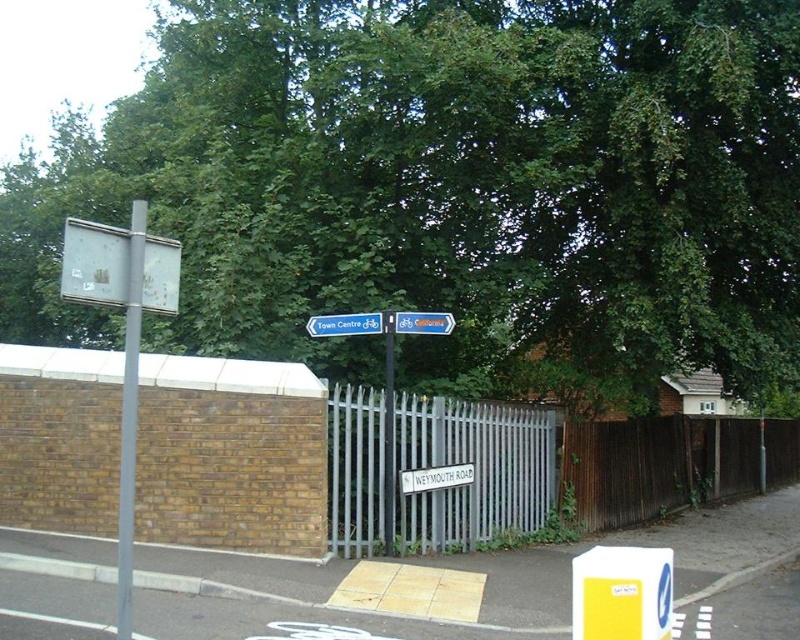
Question: Does silver metallic fence at center lie in front of gray metallic pole at left?

Choices:
 (A) no
 (B) yes

Answer: (A)

Question: Which is farther from the white plastic sign at upper left?

Choices:
 (A) yellow plastic bus stop at center
 (B) gray metallic pole at left
 (C) white plastic sign at center

Answer: (C)

Question: Which point is closer to the camera?

Choices:
 (A) (66, 259)
 (B) (393, 528)

Answer: (A)

Question: Can you confirm if green leafy tree at upper center is positioned to the left of metallic blue bicycle sign at center?

Choices:
 (A) yes
 (B) no

Answer: (A)

Question: Can you confirm if brown wooden fence at right is positioned to the left of gray metallic pole at left?

Choices:
 (A) yes
 (B) no

Answer: (B)

Question: Which point appears closest to the camera in this image?

Choices:
 (A) (x=396, y=316)
 (B) (x=82, y=232)

Answer: (B)